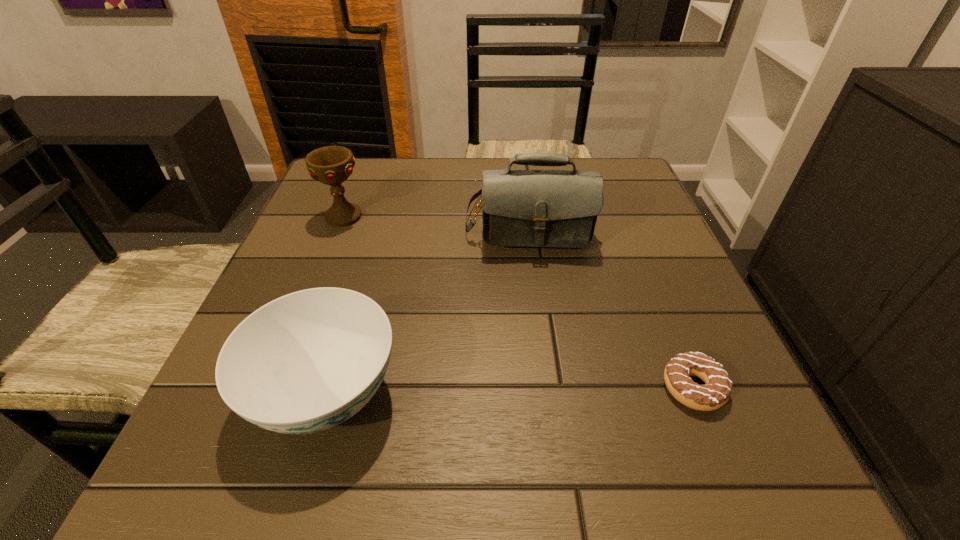
Find the location of a particular element. This screenshot has width=960, height=540. the third object from left to right is located at coordinates 520,208.

The image size is (960, 540). I want to click on shoulder bag, so click(x=520, y=208).

Find the location of a particular element. The width and height of the screenshot is (960, 540). the second tallest object is located at coordinates (331, 165).

This screenshot has height=540, width=960. Find the location of `the second shortest object`. the second shortest object is located at coordinates (305, 362).

What are the coordinates of `the rightmost object` in the screenshot? It's located at (716, 392).

Image resolution: width=960 pixels, height=540 pixels. I want to click on doughnut, so point(716,392).

You are a GUI agent. You are given a task and a screenshot of the screen. Output one action in this format:
    pyautogui.click(x=<x>, y=<y>)
    Task: Click on the free point located 0.050m on the front of the third object from left to right
    
    Given the screenshot: What is the action you would take?
    pyautogui.click(x=536, y=276)

At what (x,y) coordinates should I click in order to perform the action: click on free region located 0.190m on the back of the third shortest object. Please return your answer as a coordinate pair (x, y). Looking at the image, I should click on (364, 164).

At what (x,y) coordinates should I click in order to perform the action: click on vacant region located on the right of the chinaware. Please return your answer as a coordinate pair (x, y). Looking at the image, I should click on (575, 394).

What are the coordinates of `free space located 0.310m on the back of the rightmost object` in the screenshot? It's located at (634, 241).